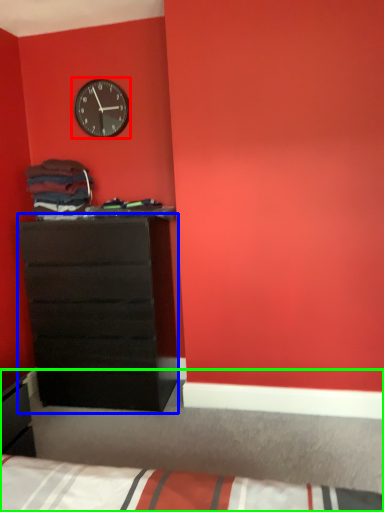
Question: Which is nearer to the wall clock (highlighted by a red box)? chest of drawers (highlighted by a blue box) or bed (highlighted by a green box).

Choices:
 (A) chest of drawers
 (B) bed

Answer: (A)